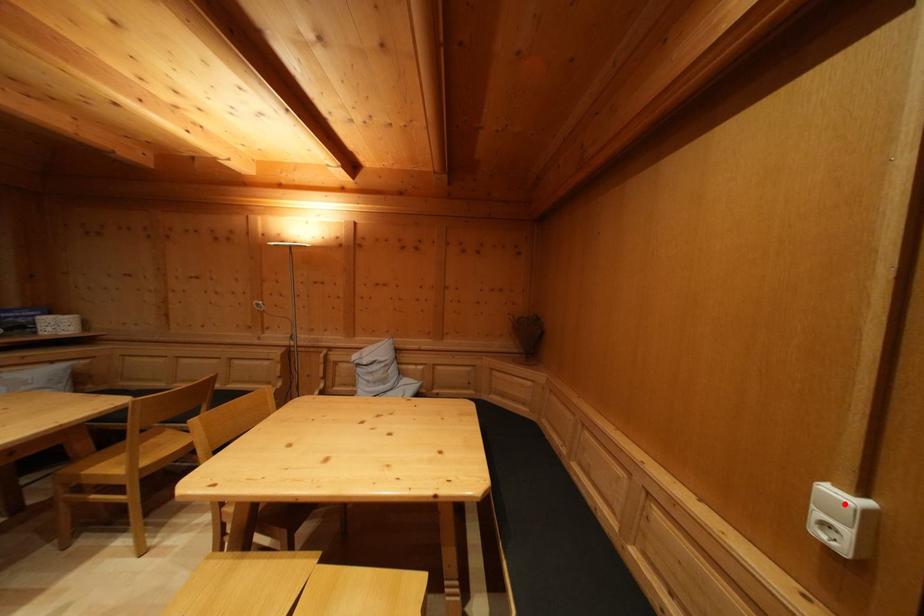
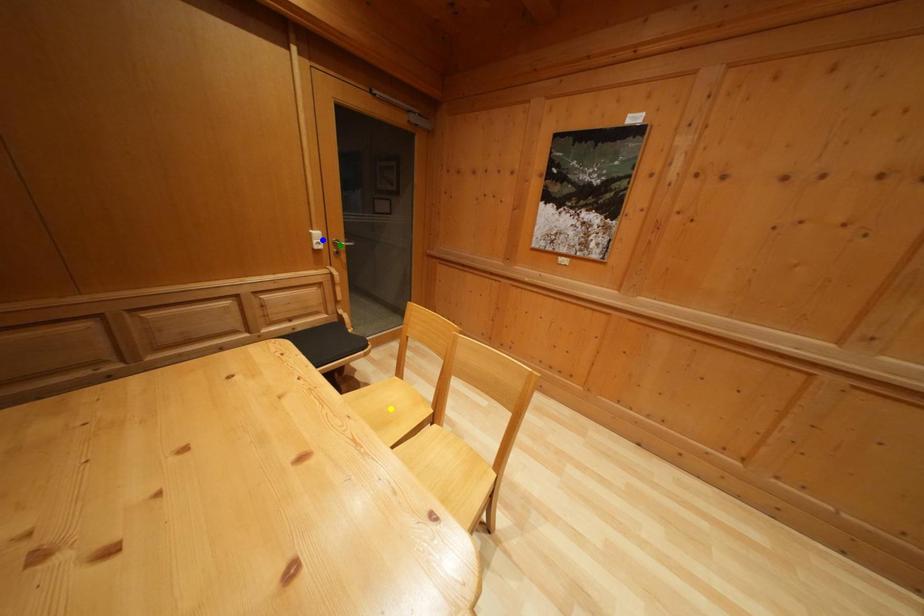
Question: I am providing you with two images of the same scene from different viewpoints. A red point is marked on the first image. You are given multiple points on the second image. In image 2, which mark is for the same physical point as the one in image 1?

Choices:
 (A) blue point
 (B) yellow point
 (C) green point

Answer: (A)